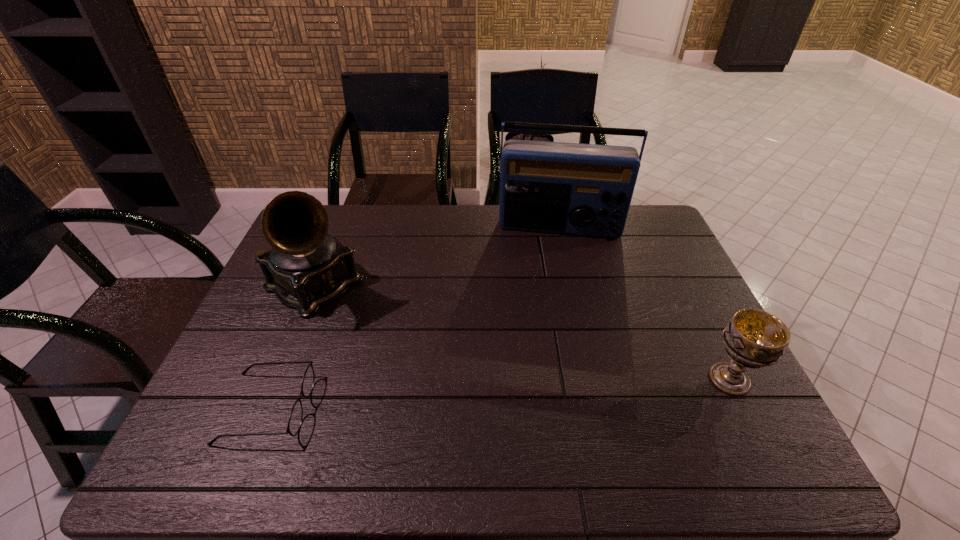
In order to click on spectacles in this screenshot , I will do `click(295, 419)`.

Identify the location of the third tallest object. (753, 338).

Locate an element on the screen. The width and height of the screenshot is (960, 540). chalice is located at coordinates (753, 338).

Identify the location of the second farthest object. (307, 268).

Where is `radio receiver`? radio receiver is located at coordinates (554, 187).

This screenshot has height=540, width=960. Identify the location of the farthest object. (554, 187).

The height and width of the screenshot is (540, 960). Identify the location of vacant space located 0.290m on the front-facing side of the spectacles. (436, 408).

Identify the location of free space located 0.400m on the back of the rightmost object. (669, 257).

Where is `vacant position located 0.350m on the horn of the phonograph record`? vacant position located 0.350m on the horn of the phonograph record is located at coordinates (440, 374).

You are a GUI agent. You are given a task and a screenshot of the screen. Output one action in this format:
    pyautogui.click(x=<x>, y=<y>)
    Task: Click on the free space located on the horn of the phonograph record
    
    Given the screenshot: What is the action you would take?
    pyautogui.click(x=407, y=352)